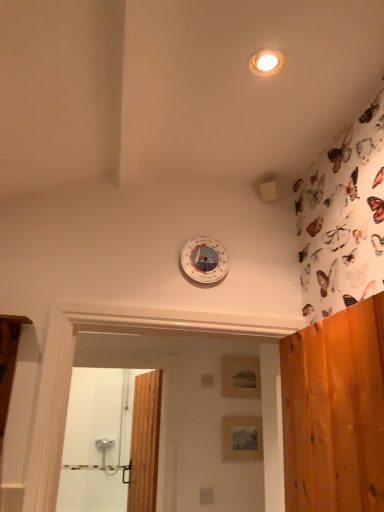
Question: Does matte wooden panel at center, placed as the first panel when sorted from front to back, appear on the right side of wooden door at center?

Choices:
 (A) no
 (B) yes

Answer: (B)

Question: Is matte wooden panel at center, the second panel from the top, at the left side of wooden door at center?

Choices:
 (A) no
 (B) yes

Answer: (A)

Question: Does matte wooden panel at center, the second panel from the top, have a larger size compared to wooden door at center?

Choices:
 (A) no
 (B) yes

Answer: (A)

Question: Is matte wooden panel at center, the second panel from the top, taller than wooden door at center?

Choices:
 (A) yes
 (B) no

Answer: (B)

Question: Is matte wooden panel at center, the second panel from the back, positioned in front of wooden door at center?

Choices:
 (A) no
 (B) yes

Answer: (A)

Question: Considering the relative sizes of matte wooden panel at center, placed as the first panel when sorted from front to back, and wooden door at center in the image provided, is matte wooden panel at center, placed as the first panel when sorted from front to back, shorter than wooden door at center?

Choices:
 (A) no
 (B) yes

Answer: (B)

Question: Is matte white light fixture at upper center wider than wooden door at center?

Choices:
 (A) no
 (B) yes

Answer: (A)

Question: Can you confirm if matte white light fixture at upper center is positioned to the right of wooden door at center?

Choices:
 (A) yes
 (B) no

Answer: (A)

Question: Is matte white light fixture at upper center located outside wooden door at center?

Choices:
 (A) no
 (B) yes

Answer: (B)

Question: From a real-world perspective, is matte white light fixture at upper center below wooden door at center?

Choices:
 (A) yes
 (B) no

Answer: (B)

Question: Is matte white light fixture at upper center shorter than wooden door at center?

Choices:
 (A) no
 (B) yes

Answer: (B)

Question: From the image's perspective, does matte white light fixture at upper center appear lower than wooden door at center?

Choices:
 (A) yes
 (B) no

Answer: (B)

Question: From the image's perspective, is wooden door at center above white plastic clock at upper center?

Choices:
 (A) yes
 (B) no

Answer: (B)